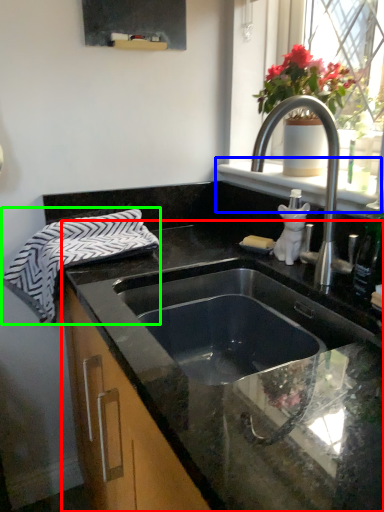
Question: Based on their relative distances, which object is nearer to countertop (highlighted by a red box)? Choose from window sill (highlighted by a blue box) and beach towel (highlighted by a green box).

Choices:
 (A) window sill
 (B) beach towel

Answer: (B)